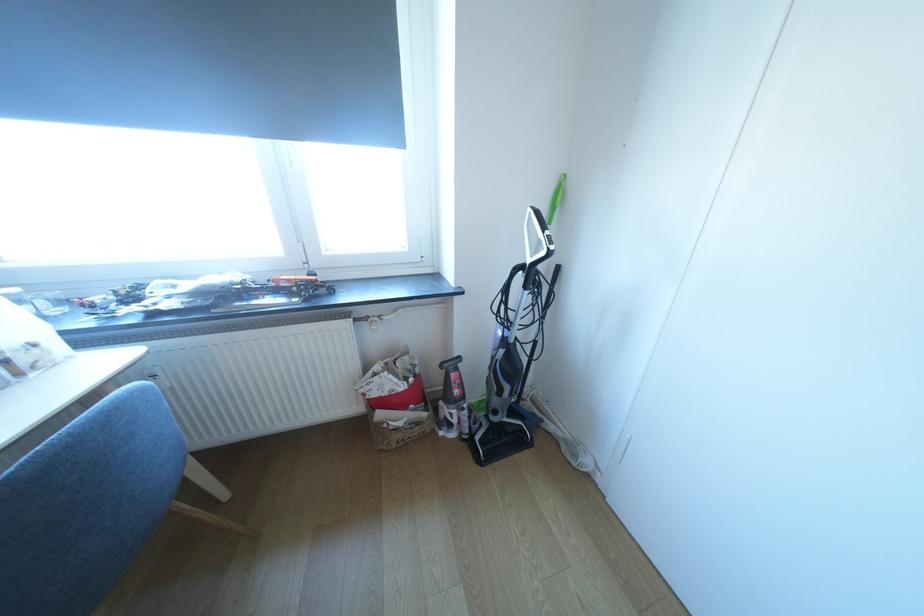
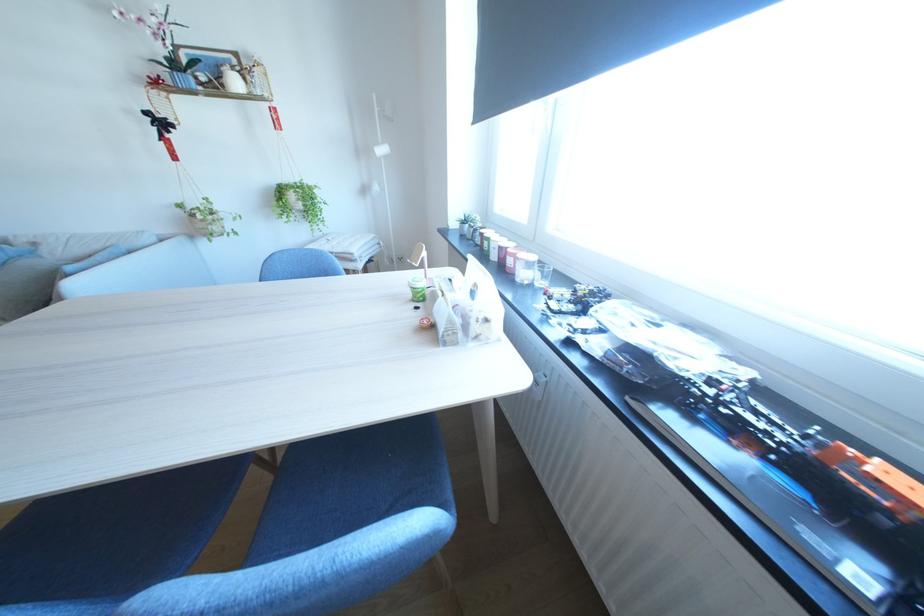
In the second image, find the point that corresponds to the point at 56,315 in the first image.

(545, 285)